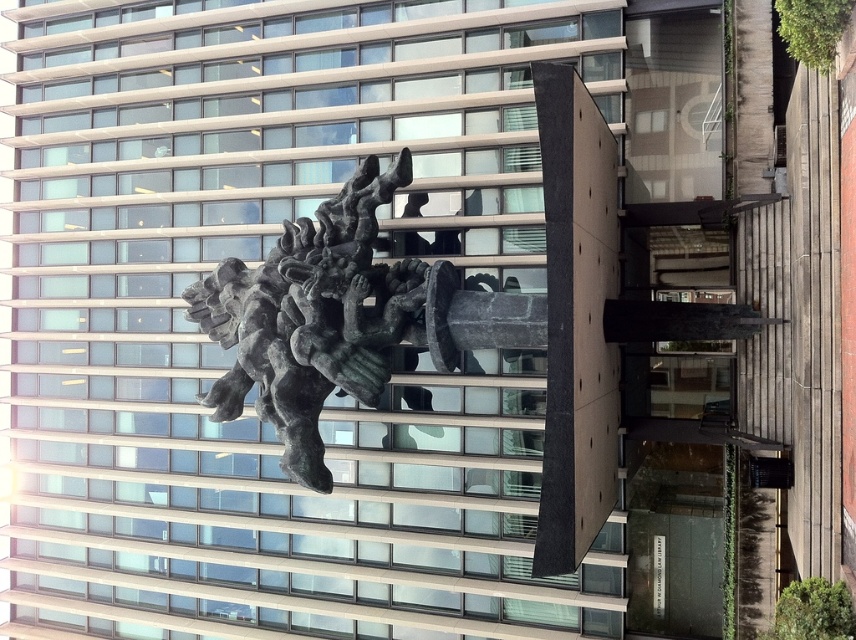
Who is positioned more to the left, clear glass windows at center or bronze statue at center?

clear glass windows at center

Can you confirm if clear glass windows at center is thinner than bronze statue at center?

No, clear glass windows at center is not thinner than bronze statue at center.

Does point (418, 99) come in front of point (346, 282)?

No, it is not.

Locate an element on the screen. The image size is (856, 640). clear glass windows at center is located at coordinates (232, 352).